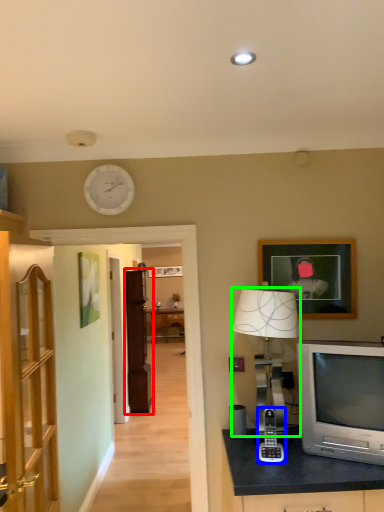
Question: Considering the real-world distances, which object is closest to cabinetry (highlighted by a red box)? gadget (highlighted by a blue box) or table lamp (highlighted by a green box).

Choices:
 (A) gadget
 (B) table lamp

Answer: (A)